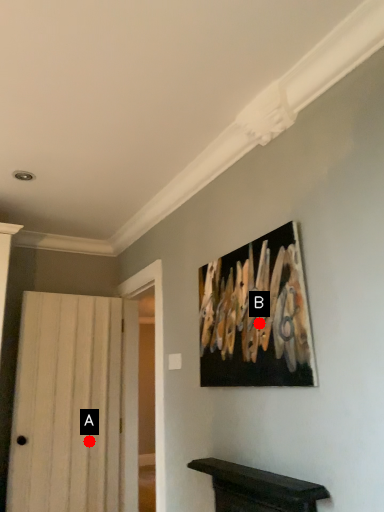
Question: Two points are circled on the image, labeled by A and B beside each circle. Which point is closer to the camera?

Choices:
 (A) A is closer
 (B) B is closer

Answer: (B)